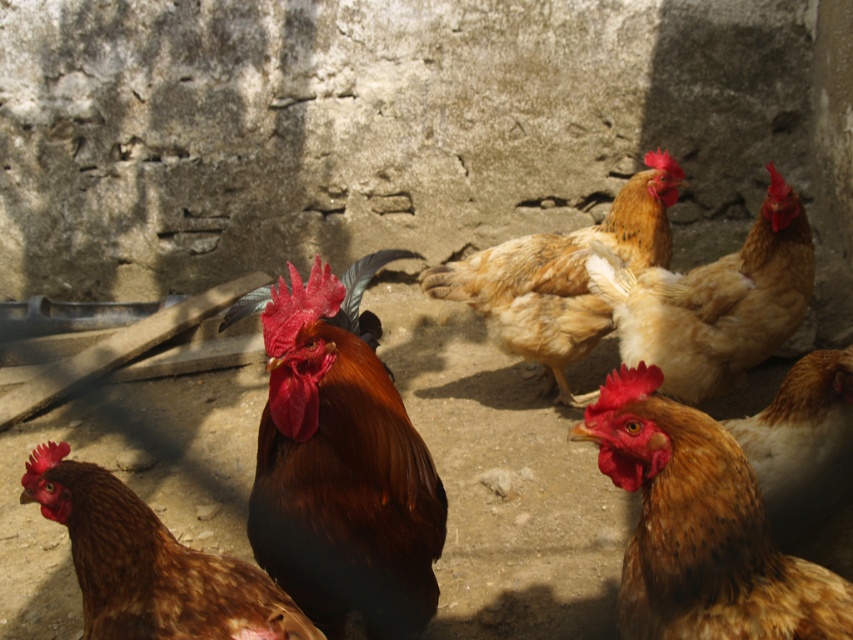
You are a farmer checking the chickens. You notice a brown speckled feather at lower left and brown speckled feathers at center. Which one is wider?

The brown speckled feather at lower left is wider than the brown speckled feathers at center.

You are a farmer who wants to identify the tallest rooster in the group. According to the image, which rooster is taller between the shiny brown rooster at center and the brown feathered rooster at center?

The shiny brown rooster at center is much taller than the brown feathered rooster at center.

You are a farmer checking the chickens. You notice two roosters at the center. Which one is wider, the shiny brown rooster at center or the brown feathered rooster at center?

The shiny brown rooster at center is wider than the brown feathered rooster at center according to the description.